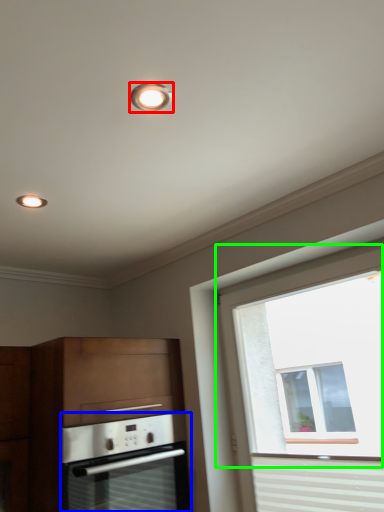
Question: Estimate the real-world distances between objects in this image. Which object is farther from lighting (highlighted by a red box), oven (highlighted by a blue box) or window (highlighted by a green box)?

Choices:
 (A) oven
 (B) window

Answer: (B)